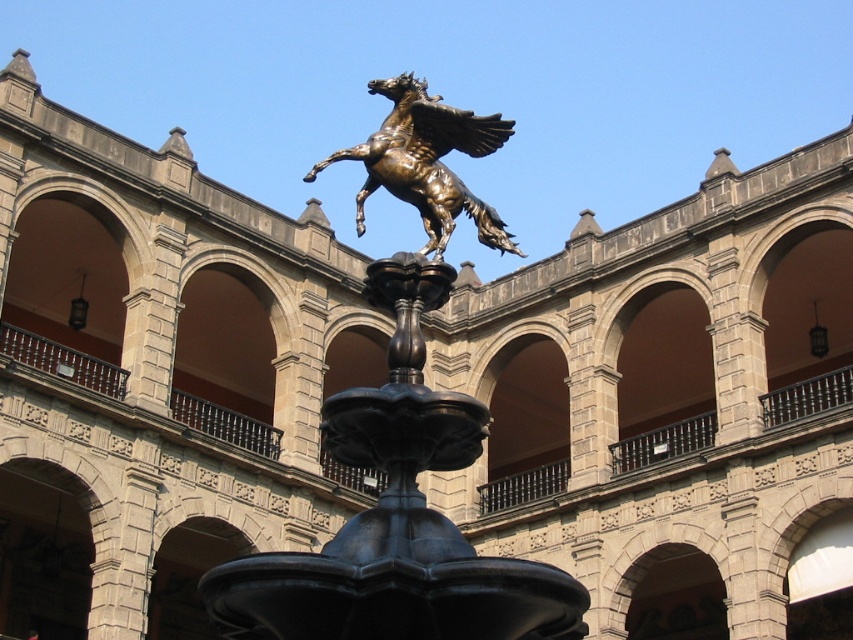
Is the position of bronze/statue at center more distant than that of brown stone archway at center?

No, bronze/statue at center is closer to the viewer.

Does bronze/statue at center lie in front of brown stone archway at center?

That is True.

Locate an element on the screen. bronze/statue at center is located at coordinates (426, 163).

Where is `bronze/statue at center`? The height and width of the screenshot is (640, 853). bronze/statue at center is located at coordinates (426, 163).

From the picture: Is black polished fountain at center positioned at the back of brown stone archway at center?

That is False.

Image resolution: width=853 pixels, height=640 pixels. What do you see at coordinates (397, 516) in the screenshot?
I see `black polished fountain at center` at bounding box center [397, 516].

Does point (368, 541) lie behind point (688, 296)?

No, it is not.

This screenshot has width=853, height=640. Identify the location of black polished fountain at center. (397, 516).

Can you confirm if black polished fountain at center is positioned to the left of bronze/statue at center?

Indeed, black polished fountain at center is positioned on the left side of bronze/statue at center.

Can you confirm if black polished fountain at center is positioned above bronze/statue at center?

No, black polished fountain at center is not above bronze/statue at center.

Identify the location of black polished fountain at center. (397, 516).